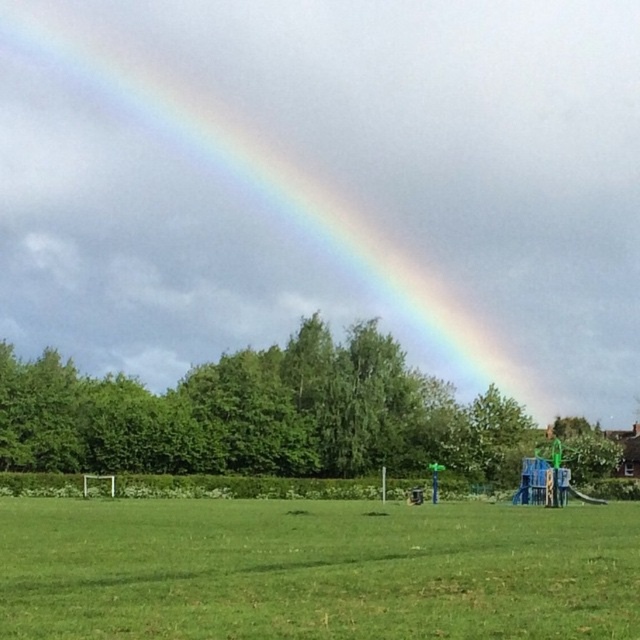
Question: Does rainbow at upper center have a smaller size compared to green grassy field at lower center?

Choices:
 (A) yes
 (B) no

Answer: (B)

Question: Does rainbow at upper center have a greater width compared to green grassy field at lower center?

Choices:
 (A) no
 (B) yes

Answer: (B)

Question: Which point appears closest to the camera in this image?

Choices:
 (A) (368, 566)
 (B) (141, 358)

Answer: (A)

Question: Does rainbow at upper center have a greater width compared to green grassy field at lower center?

Choices:
 (A) yes
 (B) no

Answer: (A)